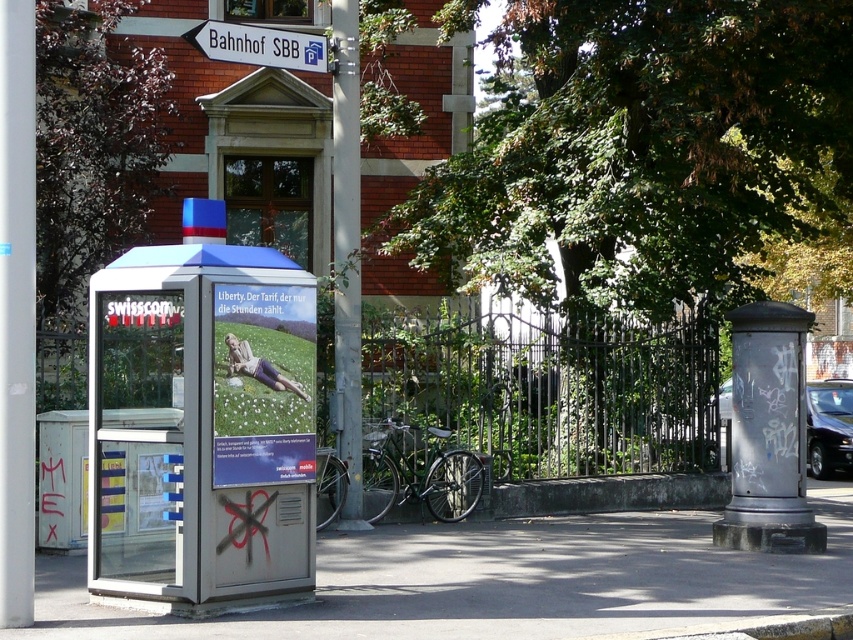
You are a delivery person standing at the point marked by the coordinates (505, 580). What material are you standing on?

The point at (505, 580) is concrete pavement at lower center, so you are standing on concrete pavement.

You are a delivery person with a cart that is 2 meters wide. You need to move your cart from the concrete pavement at lower center to the metallic gray pole at center. Is there enough space for your cart to pass between them?

The distance between the concrete pavement at lower center and the metallic gray pole at center is 3.30 meters. Since your cart is 2 meters wide, there is sufficient space for the cart to pass between them.

Looking at this image, you are a delivery person trying to park your 1.2 meter wide cart between the concrete pavement at lower center and the metallic gray pole at center. Can your cart fit in the space between them?

The concrete pavement at lower center has a lesser width compared to metallic gray pole at center, so the space between them is narrower than the pole. Since your cart is 1.2 meters wide, it might not fit if the space is narrower than that. However, without exact measurements, it is uncertain.